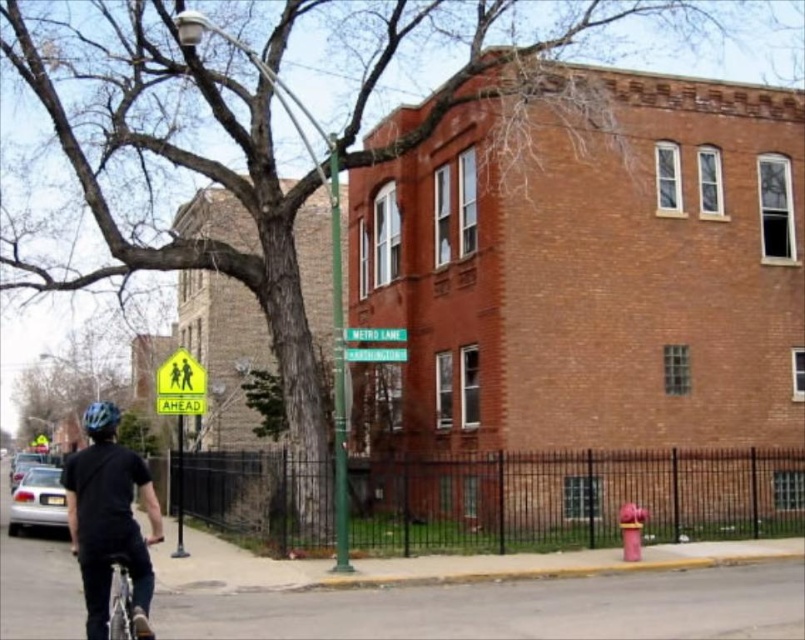
Who is positioned more to the right, matte pink fire hydrant at lower right or shiny blue helmet at lower left?

matte pink fire hydrant at lower right

Is point (636, 515) farther from viewer compared to point (102, 410)?

Yes, point (636, 515) is behind point (102, 410).

Which is behind, point (644, 513) or point (105, 401)?

The point (105, 401) is more distant.

You are a GUI agent. You are given a task and a screenshot of the screen. Output one action in this format:
    pyautogui.click(x=<x>, y=<y>)
    Task: Click on the matte pink fire hydrant at lower right
    The height and width of the screenshot is (640, 805).
    Given the screenshot: What is the action you would take?
    pyautogui.click(x=630, y=531)

Does silver metallic bicycle at lower left appear under shiny blue helmet at lower left?

No.

Between point (98, 586) and point (91, 422), which one is positioned in front?

Point (98, 586) is more forward.

Which is behind, point (133, 564) or point (89, 417)?

Point (89, 417)

In order to click on silver metallic bicycle at lower left in this screenshot , I will do `click(110, 582)`.

Measure the distance between point (93, 412) and camera.

Point (93, 412) and camera are 23.08 feet apart from each other.

Does shiny blue helmet at lower left appear over green plastic street sign at center?

Actually, shiny blue helmet at lower left is below green plastic street sign at center.

Describe the element at coordinates (100, 416) in the screenshot. This screenshot has height=640, width=805. I see `shiny blue helmet at lower left` at that location.

You are a GUI agent. You are given a task and a screenshot of the screen. Output one action in this format:
    pyautogui.click(x=<x>, y=<y>)
    Task: Click on the shiny blue helmet at lower left
    This screenshot has width=805, height=640.
    Given the screenshot: What is the action you would take?
    pyautogui.click(x=100, y=416)